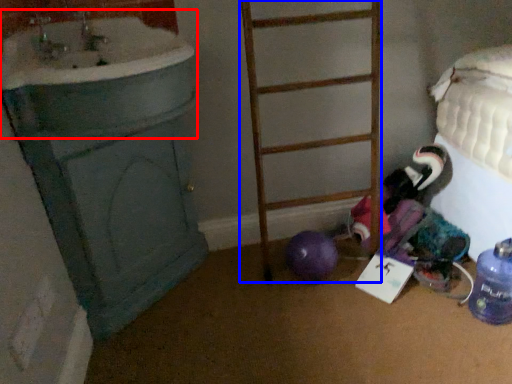
Question: Which of the following is the farthest to the observer, sink (highlighted by a red box) or ladder (highlighted by a blue box)?

Choices:
 (A) sink
 (B) ladder

Answer: (B)